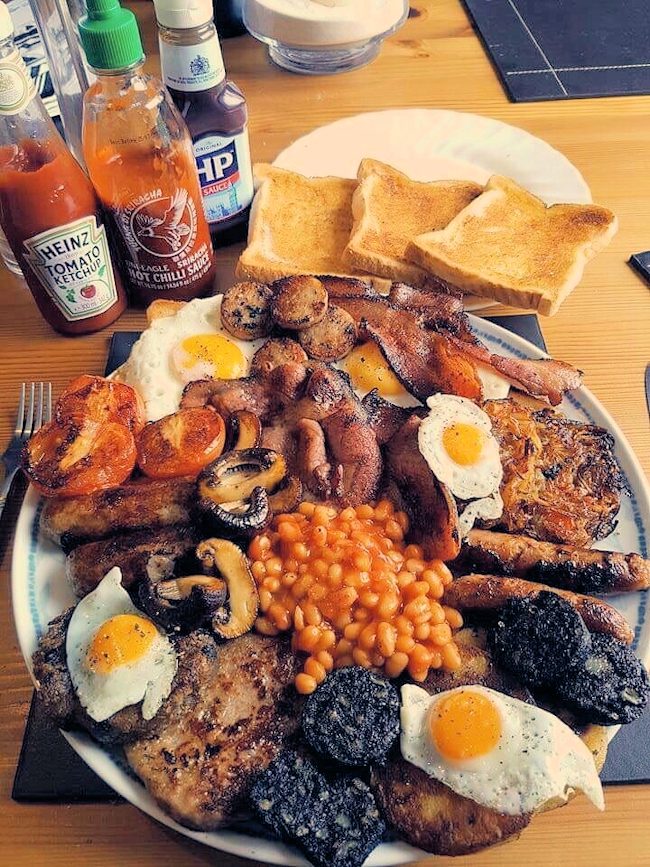
This screenshot has height=867, width=650. Find the location of `placemat`. placemat is located at coordinates point(44,779), point(587,60).